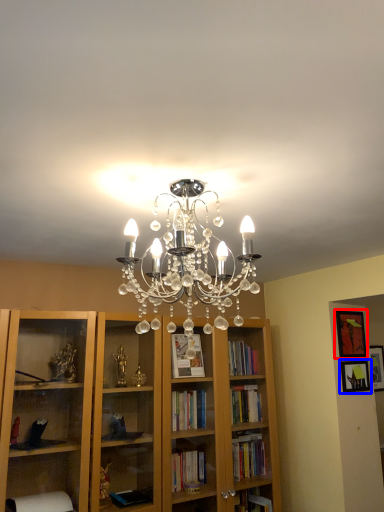
Question: Among these objects, which one is nearest to the camera, picture frame (highlighted by a red box) or picture frame (highlighted by a blue box)?

Choices:
 (A) picture frame
 (B) picture frame

Answer: (B)